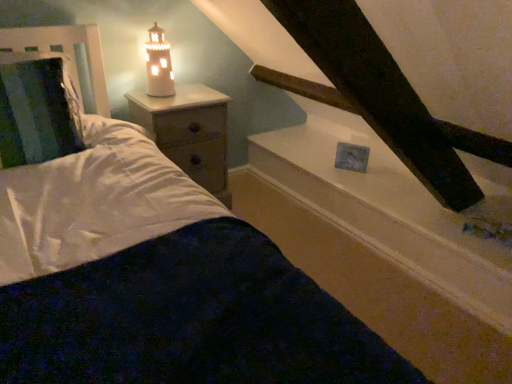
Question: Can you confirm if white soft bedding at center is shorter than white glossy window sill at upper center?

Choices:
 (A) no
 (B) yes

Answer: (B)

Question: From a real-world perspective, is white soft bedding at center located beneath white glossy window sill at upper center?

Choices:
 (A) no
 (B) yes

Answer: (B)

Question: Considering the relative sizes of white soft bedding at center and white glossy window sill at upper center in the image provided, is white soft bedding at center taller than white glossy window sill at upper center?

Choices:
 (A) yes
 (B) no

Answer: (B)

Question: Does white soft bedding at center turn towards white glossy window sill at upper center?

Choices:
 (A) no
 (B) yes

Answer: (A)

Question: Does white soft bedding at center have a lesser width compared to white glossy window sill at upper center?

Choices:
 (A) no
 (B) yes

Answer: (A)

Question: In the image, is metallic silver headboard at left on the left side or the right side of white glossy window sill at upper center?

Choices:
 (A) left
 (B) right

Answer: (A)

Question: Considering their positions, is metallic silver headboard at left located in front of or behind white glossy window sill at upper center?

Choices:
 (A) behind
 (B) front

Answer: (B)

Question: Considering the positions of metallic silver headboard at left and white glossy window sill at upper center in the image, is metallic silver headboard at left wider or thinner than white glossy window sill at upper center?

Choices:
 (A) thin
 (B) wide

Answer: (A)

Question: From the image's perspective, relative to white glossy window sill at upper center, is metallic silver headboard at left above or below?

Choices:
 (A) below
 (B) above

Answer: (B)

Question: Is white glossy window sill at upper center wider or thinner than white soft bedding at center?

Choices:
 (A) thin
 (B) wide

Answer: (A)

Question: In the image, is white glossy window sill at upper center on the left side or the right side of white soft bedding at center?

Choices:
 (A) left
 (B) right

Answer: (B)

Question: Is point (451, 253) closer or farther from the camera than point (344, 342)?

Choices:
 (A) closer
 (B) farther

Answer: (B)

Question: Considering the positions of white glossy window sill at upper center and white soft bedding at center in the image, is white glossy window sill at upper center bigger or smaller than white soft bedding at center?

Choices:
 (A) big
 (B) small

Answer: (A)

Question: From the image's perspective, is white ceramic lighthouse at upper left above or below white soft bedding at center?

Choices:
 (A) above
 (B) below

Answer: (A)

Question: Is white ceramic lighthouse at upper left taller or shorter than white soft bedding at center?

Choices:
 (A) tall
 (B) short

Answer: (A)